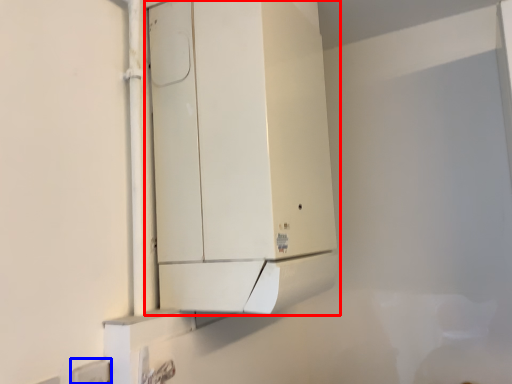
Question: Which point is closer to the camera, cabinetry (highlighted by a red box) or electric outlet (highlighted by a blue box)?

Choices:
 (A) cabinetry
 (B) electric outlet

Answer: (B)